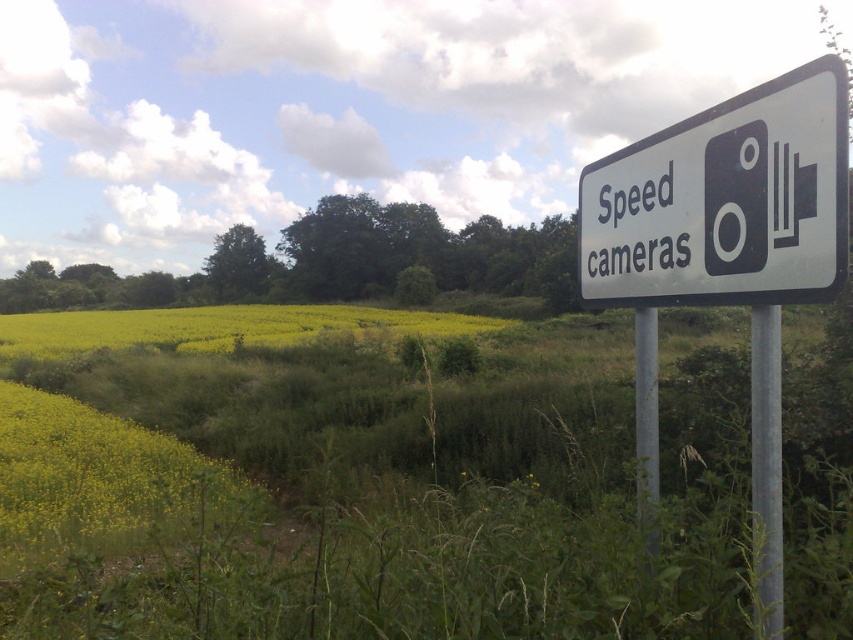
Question: Does yellow grass at lower left appear under silver metallic pole at right?

Choices:
 (A) yes
 (B) no

Answer: (A)

Question: Is the position of metallic pole at right more distant than that of silver metallic pole at right?

Choices:
 (A) yes
 (B) no

Answer: (B)

Question: Which object is farther from the camera taking this photo?

Choices:
 (A) yellow grass at lower left
 (B) white plastic sign at upper right
 (C) silver metallic pole at right
 (D) metallic pole at right

Answer: (A)

Question: Estimate the real-world distances between objects in this image. Which object is closer to the white plastic sign at upper right?

Choices:
 (A) silver metallic pole at right
 (B) yellow grass at lower left
 (C) metallic pole at right

Answer: (C)

Question: Can you confirm if yellow grass at lower left is wider than metallic pole at right?

Choices:
 (A) no
 (B) yes

Answer: (B)

Question: Which of the following is the closest to the observer?

Choices:
 (A) (755, 451)
 (B) (833, 122)
 (C) (642, 330)
 (D) (45, 419)

Answer: (B)